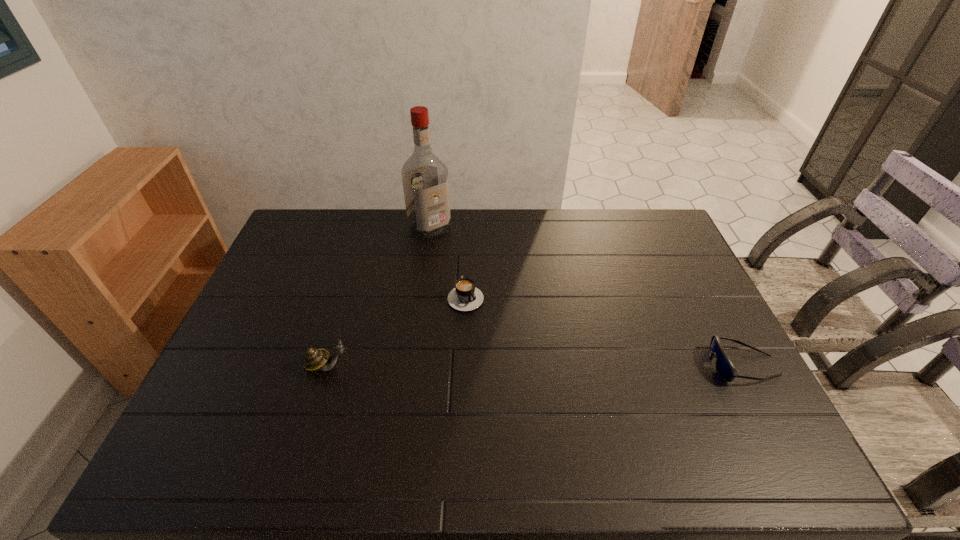
At what (x,y) coordinates should I click in order to perform the action: click on vacant space at the near edge of the desktop. Please return your answer as a coordinate pair (x, y). Looking at the image, I should click on (393, 410).

You are a GUI agent. You are given a task and a screenshot of the screen. Output one action in this format:
    pyautogui.click(x=<x>, y=<y>)
    Task: Click on the free region at the left edge
    The width and height of the screenshot is (960, 540).
    Given the screenshot: What is the action you would take?
    pyautogui.click(x=252, y=380)

In the image, there is a desktop. Where is `vacant space at the right edge`? The width and height of the screenshot is (960, 540). vacant space at the right edge is located at coordinates (746, 391).

Locate an element on the screen. The image size is (960, 540). free space at the near right corner is located at coordinates (744, 415).

Find the location of `vacant area between the liquor and the snail`. vacant area between the liquor and the snail is located at coordinates click(x=379, y=297).

What are the coordinates of `vacant area between the third shortest object and the third object from left to right` in the screenshot? It's located at (397, 330).

The height and width of the screenshot is (540, 960). In order to click on empty space that is in between the second tallest object and the sunglasses in this screenshot , I will do `click(536, 366)`.

Identify the location of free space between the sunglasses and the liquor. The width and height of the screenshot is (960, 540). (587, 296).

Where is `unoccupied area between the tallest object and the sunglasses`? Image resolution: width=960 pixels, height=540 pixels. unoccupied area between the tallest object and the sunglasses is located at coordinates (587, 296).

Locate an element on the screen. This screenshot has height=540, width=960. free space that is in between the second tallest object and the third nearest object is located at coordinates (397, 330).